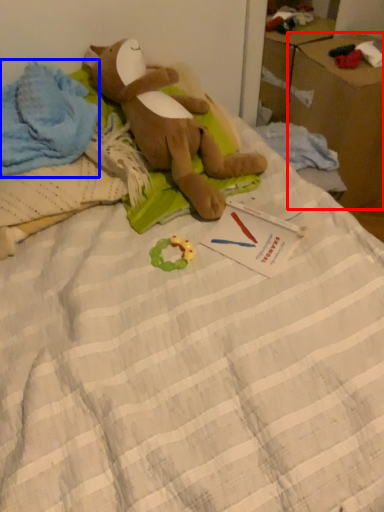
Question: Among these objects, which one is nearest to the camera, cardboard box (highlighted by a red box) or clothing (highlighted by a blue box)?

Choices:
 (A) cardboard box
 (B) clothing

Answer: (B)